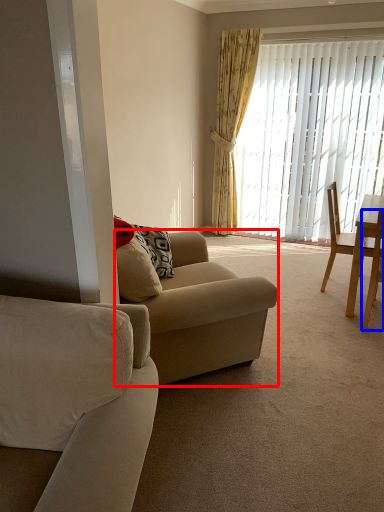
Question: Which of the following is the closest to the observer, studio couch (highlighted by a red box) or chair (highlighted by a blue box)?

Choices:
 (A) studio couch
 (B) chair

Answer: (A)